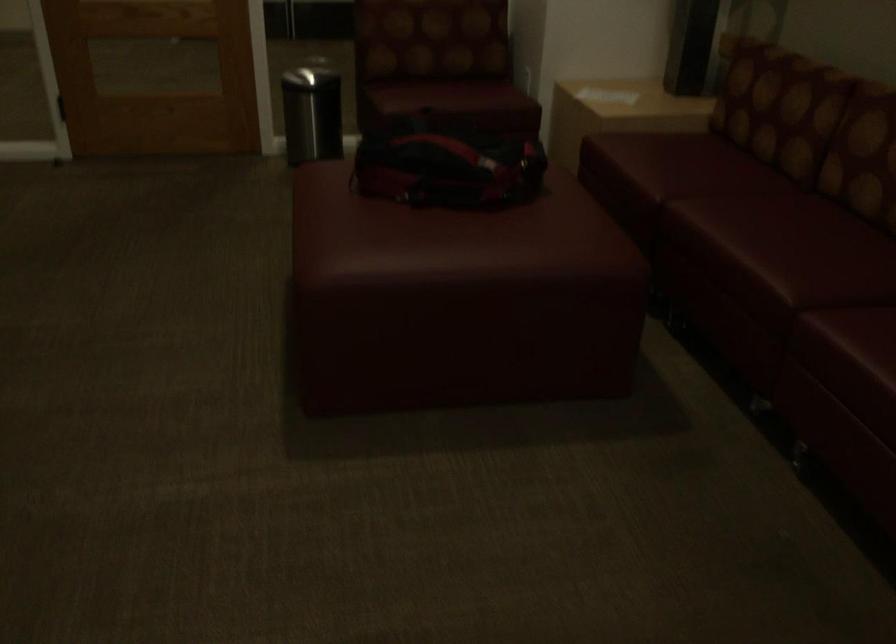
The height and width of the screenshot is (644, 896). Identify the location of metal trash can. (312, 114).